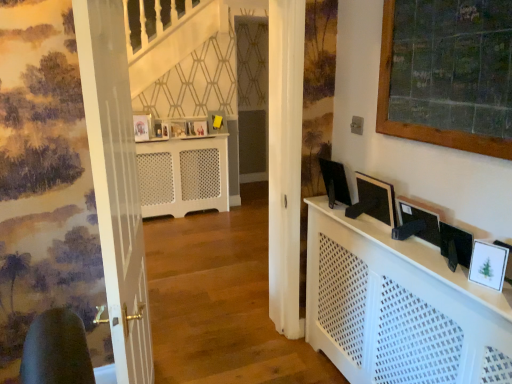
Question: From a real-world perspective, is white glossy picture frame at lower right, the fifth picture frame from the top, physically located above or below black glossy monitor at right, the 1th computer monitor when ordered from back to front?

Choices:
 (A) below
 (B) above

Answer: (A)

Question: Looking at their shapes, would you say white glossy picture frame at lower right, arranged as the 1th picture frame when viewed from the right, is wider or thinner than black glossy monitor at right, the 1th computer monitor when ordered from back to front?

Choices:
 (A) thin
 (B) wide

Answer: (A)

Question: Based on their relative distances, which object is farther from the white perforated radiator at center?

Choices:
 (A) wooden framed chalkboard at upper right
 (B) black glossy monitor at right, the 3th computer monitor from the front
 (C) white glossy picture frame at lower right, acting as the 1th picture frame starting from the bottom
 (D) white perforated cabinet at center
 (E) matte wooden picture frame at upper center, the 5th picture frame positioned from the right

Answer: (C)

Question: Which object is the closest to the white glossy door at left?

Choices:
 (A) matte white picture frame at center, the fourth picture frame when ordered from bottom to top
 (B) white perforated cabinet at center
 (C) matte wooden picture frame at center, which ranks as the 4th picture frame in right-to-left order
 (D) wooden framed chalkboard at upper right
 (E) matte yellow picture frame at center, marked as the second picture frame in a right-to-left arrangement

Answer: (B)